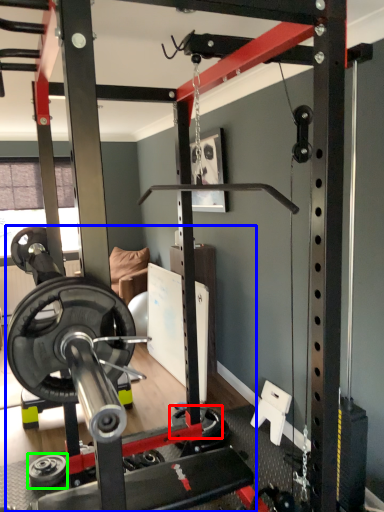
Question: Considering the real-world distances, which object is closest to wheel (highlighted by a red box)? barbell (highlighted by a blue box) or wheel (highlighted by a green box).

Choices:
 (A) barbell
 (B) wheel

Answer: (A)